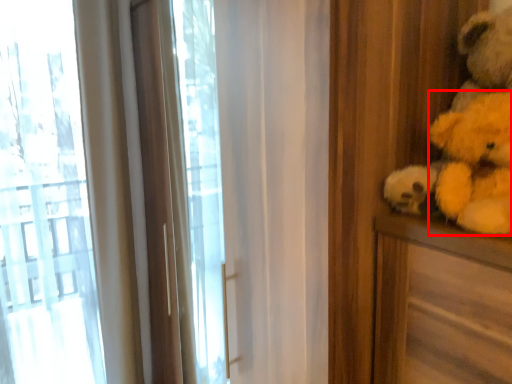
Question: Observing the image, what is the correct spatial positioning of animal (annotated by the red box) in reference to teddy bear?

Choices:
 (A) left
 (B) right

Answer: (A)